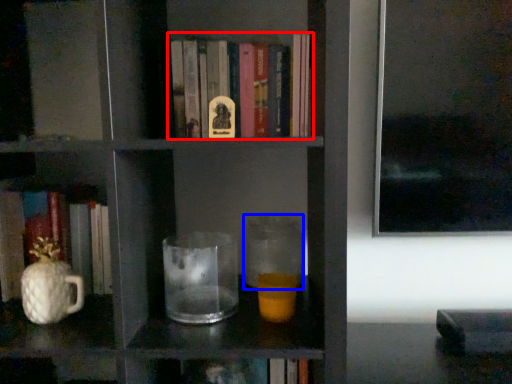
Question: Which object appears farthest to the camera in this image, book (highlighted by a red box) or glass jar (highlighted by a blue box)?

Choices:
 (A) book
 (B) glass jar

Answer: (B)